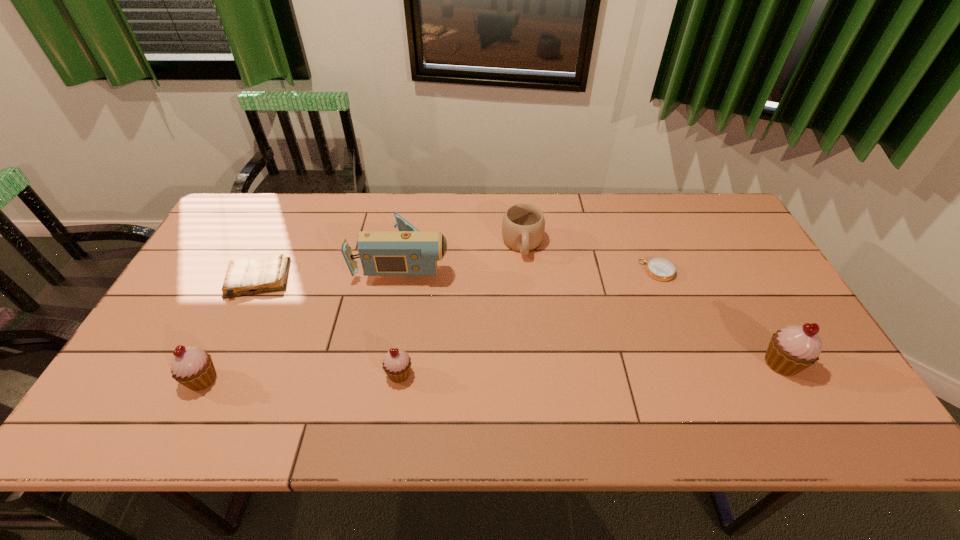
Locate an element on the screen. the leftmost cupcake is located at coordinates tap(192, 367).

Image resolution: width=960 pixels, height=540 pixels. Find the location of `the fifth shortest object`. the fifth shortest object is located at coordinates (192, 367).

What are the coordinates of `the shortest cupcake` in the screenshot? It's located at (397, 364).

At what (x,y) coordinates should I click in order to perform the action: click on the rightmost object. Please return your answer as a coordinate pair (x, y). This screenshot has height=540, width=960. Looking at the image, I should click on (792, 349).

Locate an element on the screen. Image resolution: width=960 pixels, height=540 pixels. the rightmost cupcake is located at coordinates (792, 349).

The image size is (960, 540). Find the location of `mug`. mug is located at coordinates pyautogui.click(x=523, y=225).

Locate an element on the screen. Image resolution: width=960 pixels, height=540 pixels. the sixth object from left to right is located at coordinates (660, 269).

Find the location of a particular element. The width and height of the screenshot is (960, 540). the shortest object is located at coordinates (660, 269).

The height and width of the screenshot is (540, 960). In order to click on camcorder in this screenshot , I will do `click(407, 252)`.

The height and width of the screenshot is (540, 960). Identify the location of the second shortest object. (245, 276).